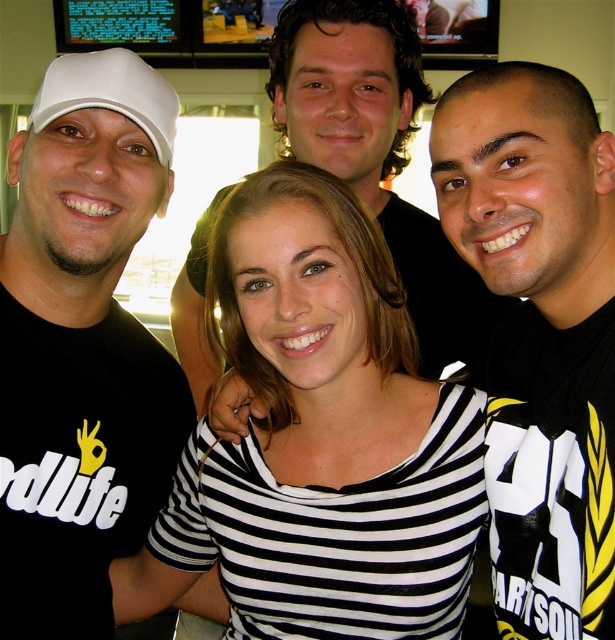
Looking at this image, is black matte t-shirt at left below black and white striped shirt at center?

Actually, black matte t-shirt at left is above black and white striped shirt at center.

Does black matte t-shirt at left appear on the right side of black and white striped shirt at center?

In fact, black matte t-shirt at left is to the left of black and white striped shirt at center.

This screenshot has width=615, height=640. What do you see at coordinates (81, 346) in the screenshot? I see `black matte t-shirt at left` at bounding box center [81, 346].

This screenshot has height=640, width=615. I want to click on black matte t-shirt at left, so (81, 346).

Can you confirm if matte black shirt at center is shorter than white matte baseball cap at left?

In fact, matte black shirt at center may be taller than white matte baseball cap at left.

Where is `matte black shirt at center`? Image resolution: width=615 pixels, height=640 pixels. matte black shirt at center is located at coordinates (375, 150).

Is point (319, 49) less distant than point (154, 84)?

No.

You are a GUI agent. You are given a task and a screenshot of the screen. Output one action in this format:
    pyautogui.click(x=<x>, y=<y>)
    Task: Click on the matte black shirt at center
    
    Given the screenshot: What is the action you would take?
    pyautogui.click(x=375, y=150)

Which of these two, black matte t-shirt at left or matte black shirt at center, stands shorter?

matte black shirt at center

Between point (79, 280) and point (351, 186), which one is positioned in front?

Positioned in front is point (79, 280).

You are a GUI agent. You are given a task and a screenshot of the screen. Output one action in this format:
    pyautogui.click(x=<x>, y=<y>)
    Task: Click on the black matte t-shirt at left
    This screenshot has width=615, height=640.
    Given the screenshot: What is the action you would take?
    click(81, 346)